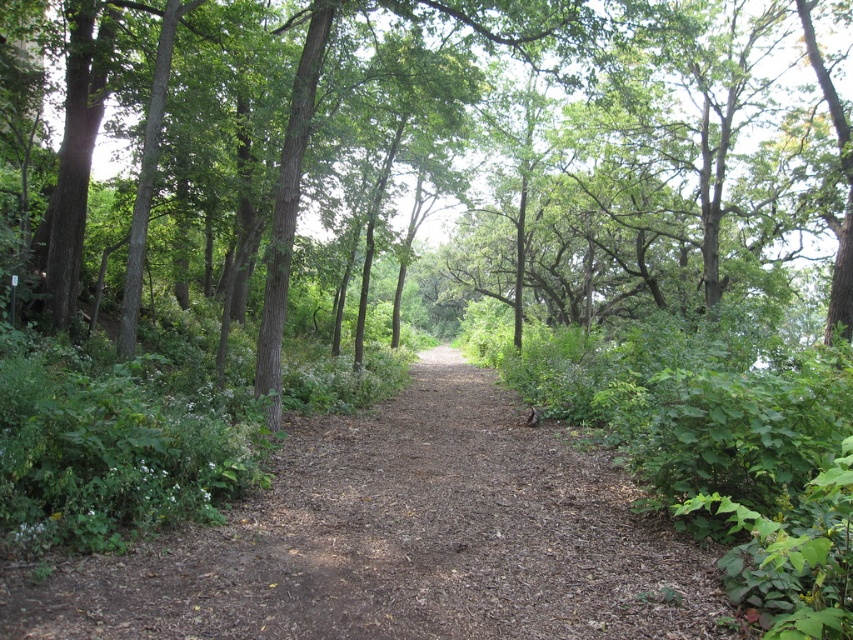
You are standing at the starting point of the dirt path in the forest. You want to reach the brown rough tree at center. Which direction should you walk to get there?

The brown rough tree at center is located at point (428,161) in the image. Since you are at the starting point of the dirt path, which is likely at the beginning of the path, you should walk forward along the path towards the center of the image to reach the brown rough tree at center.

You are a hiker walking along the dirt path in the forest. You notice a brown rough tree at center and a brown dirt trail at center. Which object is closer to you as you walk?

The brown rough tree at center is closer to you than the brown dirt trail at center because it is positioned further to the viewer, meaning it appears nearer in your line of sight.

Looking at this image, you are a hiker carrying a backpack and need to decide whether to walk along the brown dirt trail at center or around the brown rough tree at center. Which path would allow you to move more easily?

The brown dirt trail at center is easier to walk on because it is a well trodden path, while the brown rough tree at center is larger and may block your path.